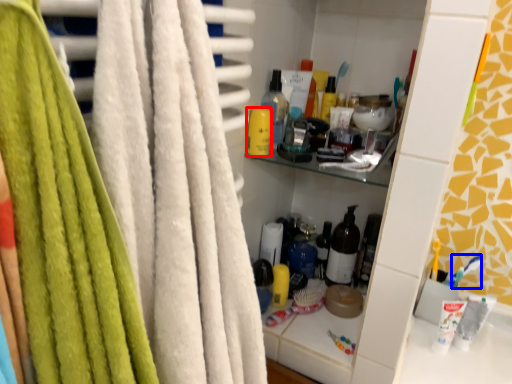
Question: Among these objects, which one is nearest to the camera, toiletry (highlighted by a red box) or toothbrush (highlighted by a blue box)?

Choices:
 (A) toiletry
 (B) toothbrush

Answer: (A)